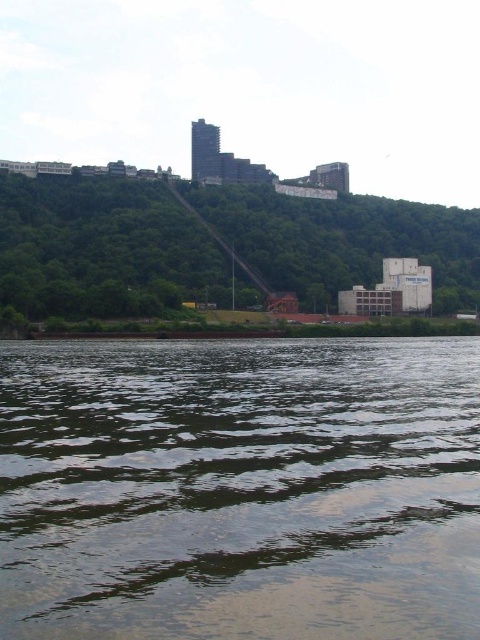
Is greenish reflective water at lower center shorter than green leafy hillside at upper center?

Correct, greenish reflective water at lower center is not as tall as green leafy hillside at upper center.

Is point (384, 401) positioned behind point (119, 196)?

No, (384, 401) is in front of (119, 196).

Is point (15, 468) positioned before point (435, 264)?

Yes, it is in front of point (435, 264).

Identify the location of greenish reflective water at lower center. Image resolution: width=480 pixels, height=640 pixels. (240, 490).